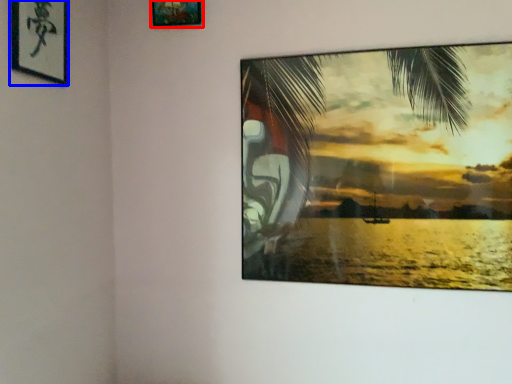
Question: Among these objects, which one is farthest to the camera, picture frame (highlighted by a red box) or picture frame (highlighted by a blue box)?

Choices:
 (A) picture frame
 (B) picture frame

Answer: (A)